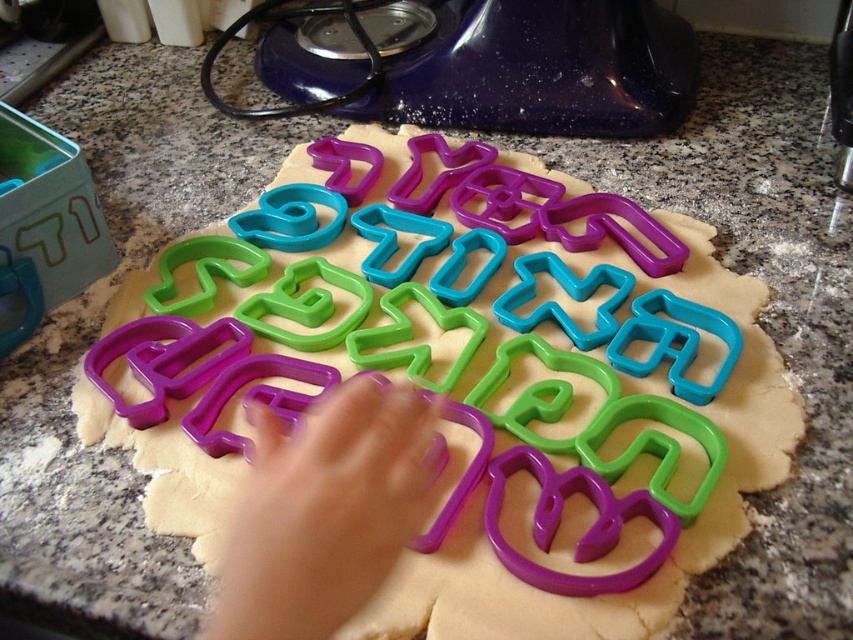
You are a baker trying to place your purple plastic hand at center on the left side of the purple plastic cookie cutters at center. Is your current arrangement correct?

The purple plastic cookie cutters at center is to the right of the purple plastic hand at center, so the current arrangement is correct because the hand is already on the left side of the cookie cutters.

You are a baker who needs to reach the purple plastic cookie cutters at center on the kitchen countertop. If your hand can extend 40 centimeters, will you be able to reach them?

The purple plastic cookie cutters at center are 41.94 centimeters away from the viewer. Since your hand can only extend 40 centimeters, you will not be able to reach them.

You are trying to determine if the purple plastic cookie cutters at center can fit in your bag which has a maximum width capacity of 10 cm. You know that the purple plastic hand at center, which is smaller than the cookie cutters, has a width of 8 cm. Can the cookie cutters fit in your bag?

The purple plastic cookie cutters at center are larger than the purple plastic hand at center, which has a width of 8 cm. Since the cookie cutters are wider than 8 cm and the bag can only hold up to 10 cm, it is possible that they might fit, but their exact width isnecessary to confirm. However, based on the given information, if the cookie cutters are wider than 8 cm but under 10 cm, they could fit. If they exceed 10 cm, they won